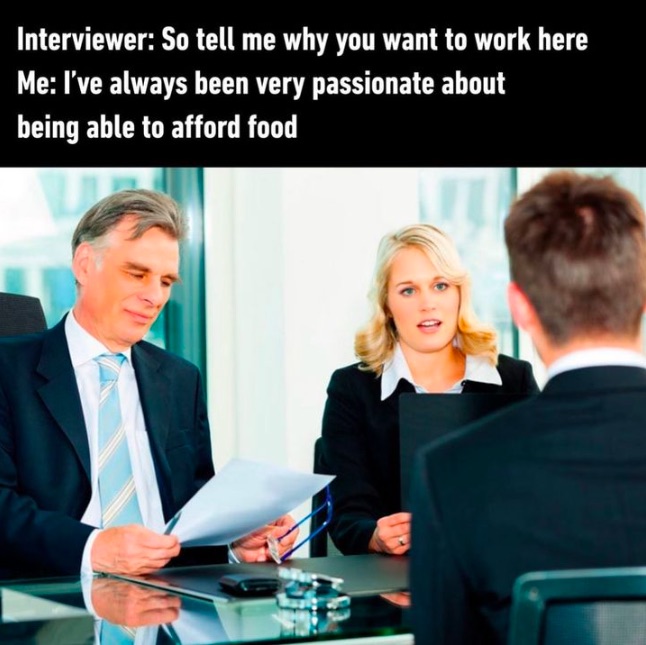
The image size is (646, 645). I want to click on desk, so click(x=146, y=633).